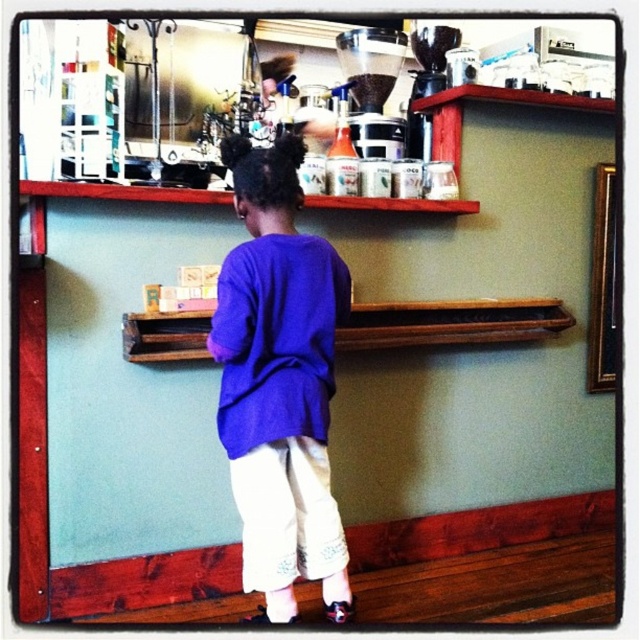
Question: Which of the following is the closest to the observer?

Choices:
 (A) (371, 88)
 (B) (339, 602)

Answer: (B)

Question: Which object appears farthest from the camera in this image?

Choices:
 (A) matte black coffee grinder at upper center
 (B) purple cotton shirt at center

Answer: (A)

Question: Does purple cotton shirt at center have a greater width compared to matte black coffee grinder at upper center?

Choices:
 (A) yes
 (B) no

Answer: (A)

Question: Is purple cotton shirt at center positioned at the back of matte black coffee grinder at upper center?

Choices:
 (A) no
 (B) yes

Answer: (A)

Question: Is purple cotton shirt at center in front of matte black coffee grinder at upper center?

Choices:
 (A) yes
 (B) no

Answer: (A)